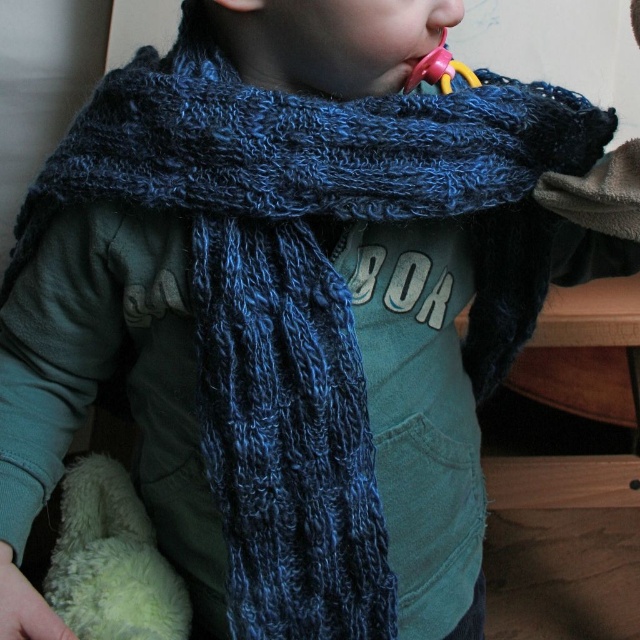
Can you confirm if rubberized yellow and pink toy at mouth is positioned to the right of smooth skin nose at upper center?

Correct, you'll find rubberized yellow and pink toy at mouth to the right of smooth skin nose at upper center.

Is rubberized yellow and pink toy at mouth taller than smooth skin nose at upper center?

Indeed, rubberized yellow and pink toy at mouth has a greater height compared to smooth skin nose at upper center.

The image size is (640, 640). What do you see at coordinates (440, 70) in the screenshot? I see `rubberized yellow and pink toy at mouth` at bounding box center [440, 70].

I want to click on rubberized yellow and pink toy at mouth, so click(x=440, y=70).